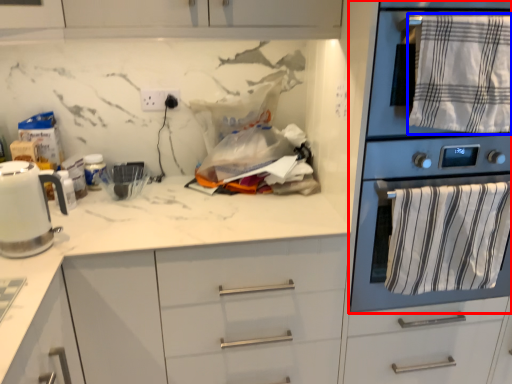
Question: Which of the following is the closest to the observer, home appliance (highlighted by a red box) or bath towel (highlighted by a blue box)?

Choices:
 (A) home appliance
 (B) bath towel

Answer: (A)